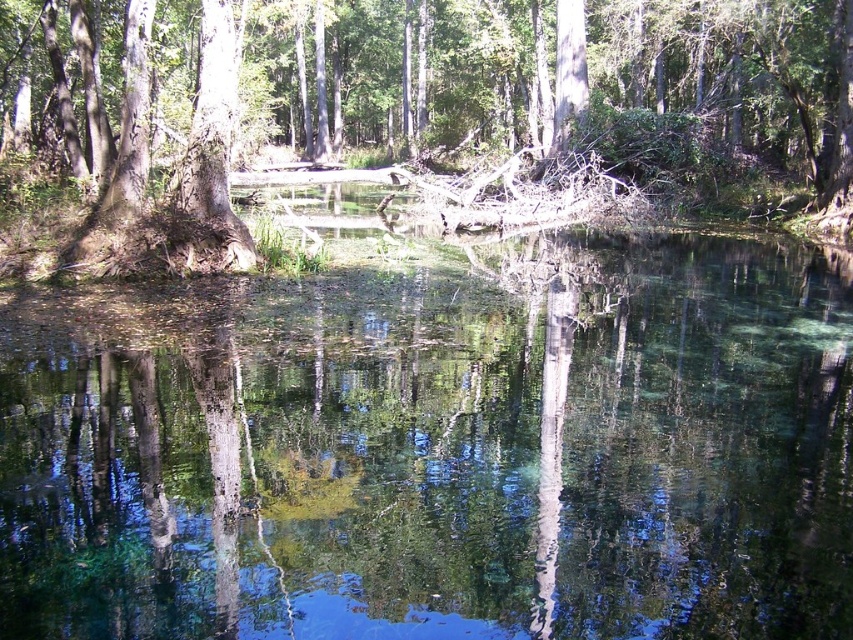
Question: Observing the image, what is the correct spatial positioning of clear water at center in reference to smooth bark tree at center?

Choices:
 (A) left
 (B) right

Answer: (B)

Question: Which point appears farthest from the camera in this image?

Choices:
 (A) (207, 349)
 (B) (650, 198)

Answer: (B)

Question: Is clear water at center to the right of smooth bark tree at center from the viewer's perspective?

Choices:
 (A) no
 (B) yes

Answer: (B)

Question: Which point is farther to the camera?

Choices:
 (A) smooth bark tree at center
 (B) clear water at center

Answer: (A)

Question: Which of the following is the closest to the observer?

Choices:
 (A) clear water at center
 (B) smooth bark tree at center

Answer: (A)

Question: Can you confirm if clear water at center is positioned to the left of smooth bark tree at center?

Choices:
 (A) yes
 (B) no

Answer: (B)